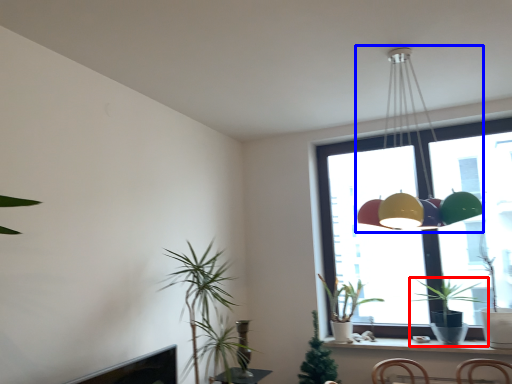
Question: Which of the following is the closest to the observer, houseplant (highlighted by a red box) or lamp (highlighted by a blue box)?

Choices:
 (A) houseplant
 (B) lamp

Answer: (B)